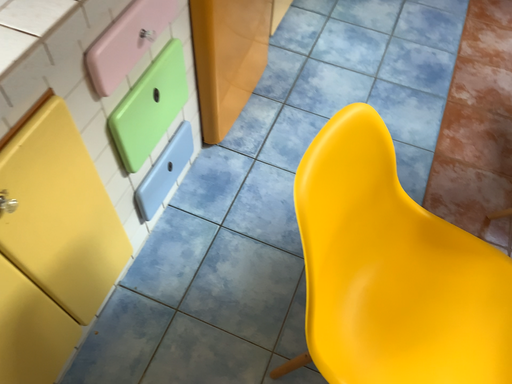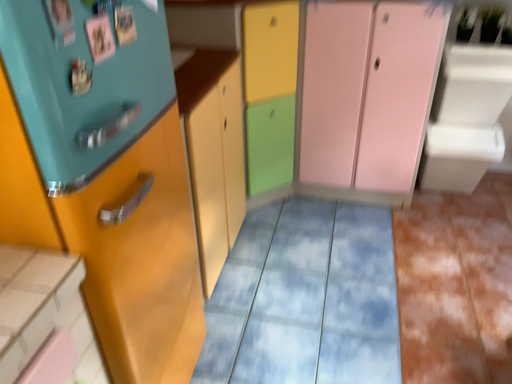
Question: How did the camera likely rotate when shooting the video?

Choices:
 (A) rotated downward
 (B) rotated upward

Answer: (B)